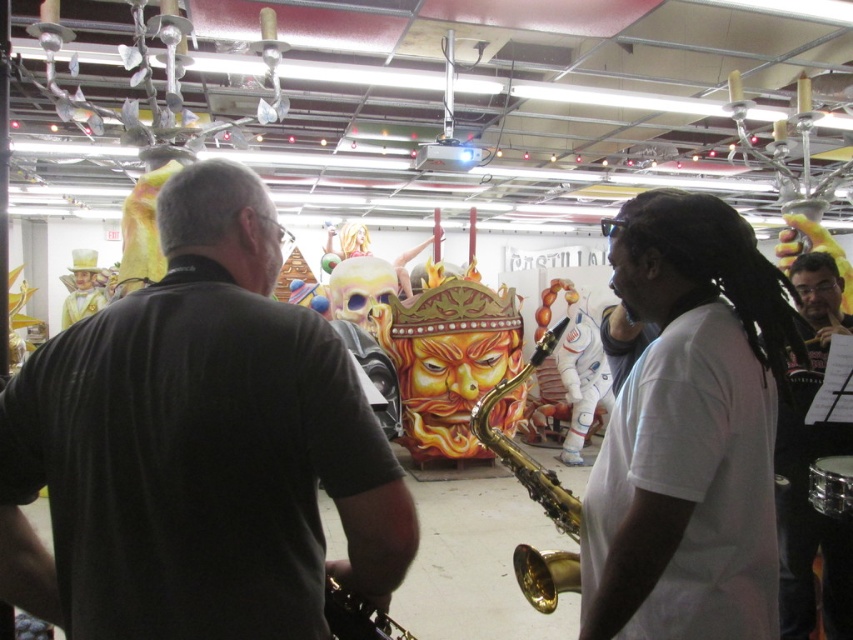
Does point (347, 541) come in front of point (810, 476)?

That is True.

Measure the distance between black matte shirt at center and camera.

black matte shirt at center is 36.76 inches from camera.

At what (x,y) coordinates should I click in order to perform the action: click on black matte shirt at center. Please return your answer as a coordinate pair (x, y). The width and height of the screenshot is (853, 640). Looking at the image, I should click on (198, 448).

Which of these two, white matte t-shirt at center or gold metallic saxophone at center, stands shorter?

With less height is gold metallic saxophone at center.

Does white matte t-shirt at center appear under gold metallic saxophone at center?

No, white matte t-shirt at center is not below gold metallic saxophone at center.

Is point (677, 225) positioned behind point (370, 621)?

That is True.

Find the location of a particular element. The image size is (853, 640). white matte t-shirt at center is located at coordinates (689, 433).

Between gold metallic saxophone at center and shiny silver drum at lower right, which one is positioned lower?

gold metallic saxophone at center is below.

Which is in front, point (334, 621) or point (845, 512)?

Positioned in front is point (334, 621).

I want to click on gold metallic saxophone at center, so [x=357, y=616].